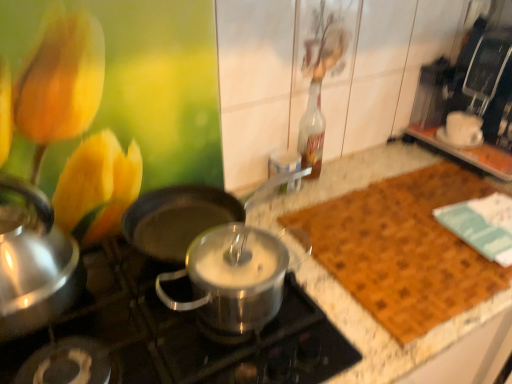
Where is `vacant space in front of translucent glass bottle at center`? The width and height of the screenshot is (512, 384). vacant space in front of translucent glass bottle at center is located at coordinates (298, 210).